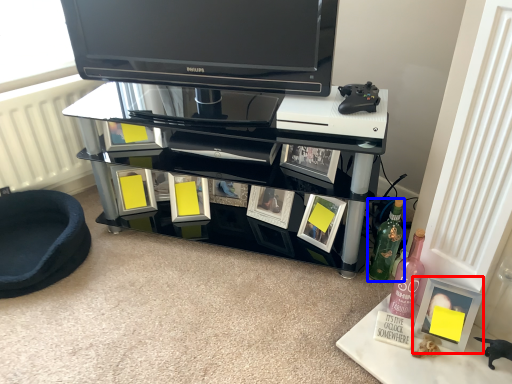
Question: Which object is further to the camera taking this photo, picture frame (highlighted by a red box) or bottle (highlighted by a blue box)?

Choices:
 (A) picture frame
 (B) bottle

Answer: (B)